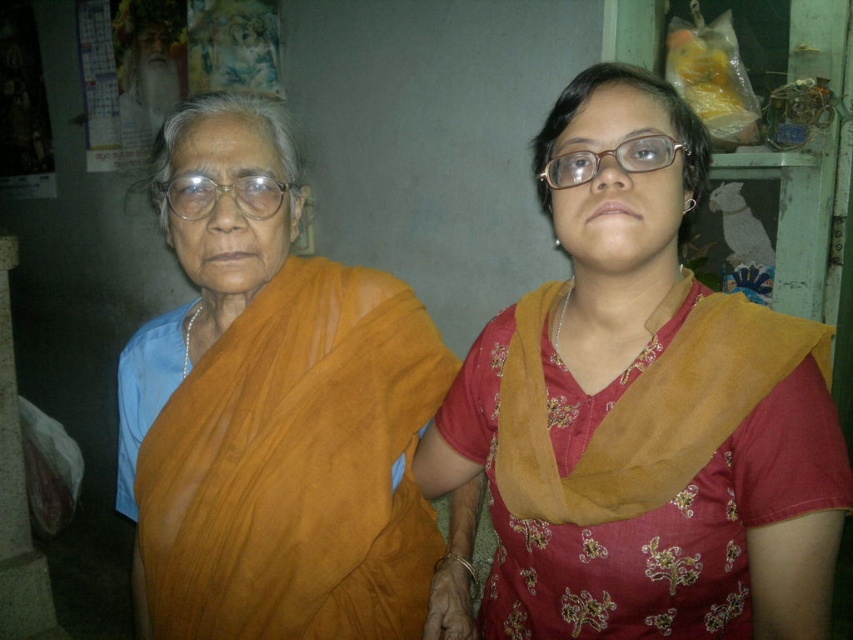
Is orange fabric sari at left above matte plastic glasses at left?

No.

Between orange fabric sari at left and matte plastic glasses at left, which one has less height?

Standing shorter between the two is matte plastic glasses at left.

Find the location of a particular element. orange fabric sari at left is located at coordinates (283, 422).

Find the location of a particular element. The width and height of the screenshot is (853, 640). orange fabric sari at left is located at coordinates (283, 422).

Can you confirm if matte plastic glasses at left is shorter than matte plastic glasses at center?

No, matte plastic glasses at left is not shorter than matte plastic glasses at center.

Between matte plastic glasses at left and matte plastic glasses at center, which one appears on the left side from the viewer's perspective?

matte plastic glasses at left is more to the left.

Locate an element on the screen. matte plastic glasses at left is located at coordinates (x=223, y=193).

Does matte orange scarf at center appear under matte plastic glasses at center?

Yes, matte orange scarf at center is below matte plastic glasses at center.

Can you confirm if matte orange scarf at center is thinner than matte plastic glasses at center?

Incorrect, matte orange scarf at center's width is not less than matte plastic glasses at center's.

Is point (688, 122) farther from camera compared to point (624, 157)?

That is True.

I want to click on matte orange scarf at center, so click(643, 417).